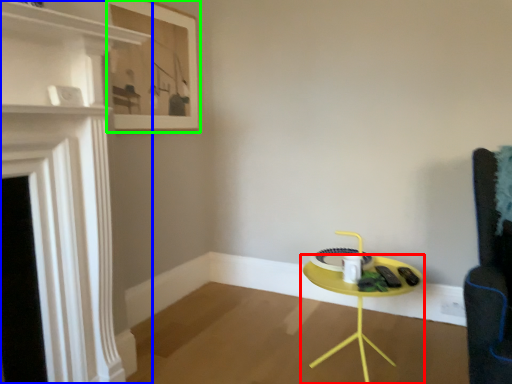
Question: Estimate the real-world distances between objects in this image. Which object is closer to table (highlighted by a red box), fireplace (highlighted by a blue box) or picture frame (highlighted by a green box)?

Choices:
 (A) fireplace
 (B) picture frame

Answer: (A)